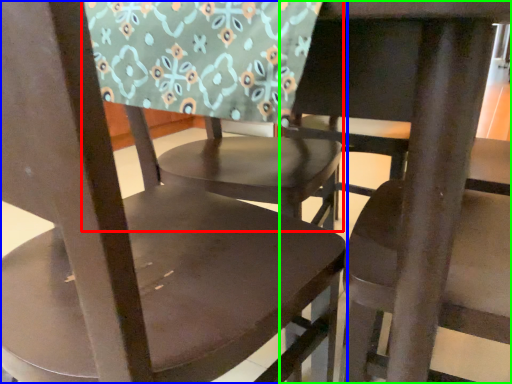
Question: Which object is the closest to the chair (highlighted by a red box)? Choose among these: chair (highlighted by a blue box) or chair (highlighted by a green box).

Choices:
 (A) chair
 (B) chair

Answer: (A)